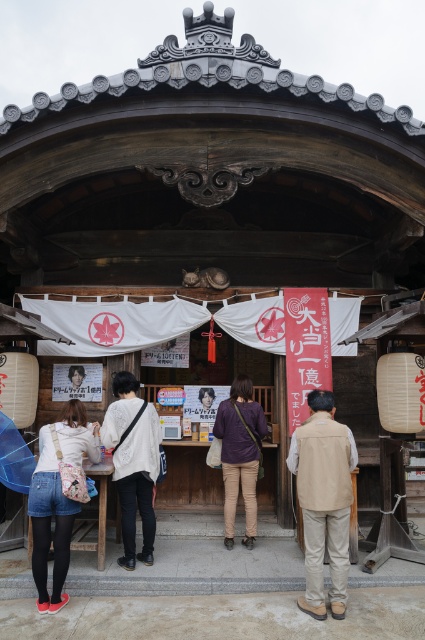
Question: Which of the following is the farthest from the observer?

Choices:
 (A) white lace shirt at center
 (B) purple cotton shirt at center
 (C) beige fabric vest at lower right
 (D) denim shorts at lower left

Answer: (B)

Question: Which of the following is the closest to the observer?

Choices:
 (A) (127, 506)
 (B) (246, 529)

Answer: (A)

Question: Where is beige fabric vest at lower right located in relation to denim shorts at lower left in the image?

Choices:
 (A) above
 (B) below

Answer: (A)

Question: Can you confirm if beige fabric vest at lower right is positioned below denim shorts at lower left?

Choices:
 (A) no
 (B) yes

Answer: (A)

Question: Among these points, which one is nearest to the camera?

Choices:
 (A) (153, 477)
 (B) (54, 547)
 (C) (248, 444)
 (D) (303, 609)

Answer: (D)

Question: Can you confirm if denim shorts at lower left is thinner than white lace shirt at center?

Choices:
 (A) yes
 (B) no

Answer: (A)